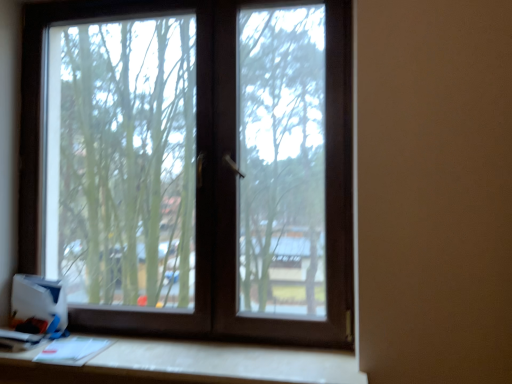
This screenshot has width=512, height=384. Find the location of `vacant space underneath white cardboard box at lower left (from a real-world perspective)`. vacant space underneath white cardboard box at lower left (from a real-world perspective) is located at coordinates (36, 337).